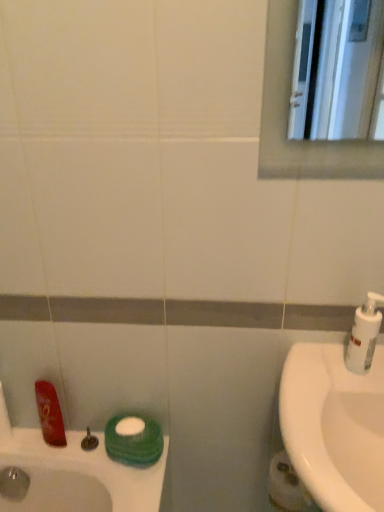
Question: Considering the relative sizes of white glossy sink at right and white matte toilet paper at lower right in the image provided, is white glossy sink at right taller than white matte toilet paper at lower right?

Choices:
 (A) yes
 (B) no

Answer: (A)

Question: Is white glossy sink at right positioned far away from white matte toilet paper at lower right?

Choices:
 (A) yes
 (B) no

Answer: (B)

Question: Is white glossy sink at right looking in the opposite direction of white matte toilet paper at lower right?

Choices:
 (A) yes
 (B) no

Answer: (B)

Question: From a real-world perspective, is white glossy sink at right positioned over white matte toilet paper at lower right based on gravity?

Choices:
 (A) yes
 (B) no

Answer: (A)

Question: Considering the relative sizes of white glossy sink at right and white matte toilet paper at lower right in the image provided, is white glossy sink at right shorter than white matte toilet paper at lower right?

Choices:
 (A) yes
 (B) no

Answer: (B)

Question: Is point (291, 500) closer or farther from the camera than point (92, 438)?

Choices:
 (A) closer
 (B) farther

Answer: (A)

Question: Considering the positions of white matte toilet paper at lower right and matte silver faucet at lower left in the image, is white matte toilet paper at lower right taller or shorter than matte silver faucet at lower left?

Choices:
 (A) tall
 (B) short

Answer: (A)

Question: Is white matte toilet paper at lower right situated inside matte silver faucet at lower left or outside?

Choices:
 (A) inside
 (B) outside

Answer: (B)

Question: Is white matte toilet paper at lower right to the left or to the right of matte silver faucet at lower left in the image?

Choices:
 (A) right
 (B) left

Answer: (A)

Question: From their relative heights in the image, would you say matte silver faucet at lower left is taller or shorter than white glossy sink at right?

Choices:
 (A) tall
 (B) short

Answer: (B)

Question: In the image, is matte silver faucet at lower left positioned in front of or behind white glossy sink at right?

Choices:
 (A) front
 (B) behind

Answer: (B)

Question: Is matte silver faucet at lower left inside or outside of white glossy sink at right?

Choices:
 (A) outside
 (B) inside

Answer: (A)

Question: Would you say matte silver faucet at lower left is to the left or to the right of white glossy sink at right in the picture?

Choices:
 (A) left
 (B) right

Answer: (A)

Question: Is white matte toilet paper at lower right in front of or behind white plastic soap dispenser at right in the image?

Choices:
 (A) behind
 (B) front

Answer: (A)

Question: Looking at their shapes, would you say white matte toilet paper at lower right is wider or thinner than white plastic soap dispenser at right?

Choices:
 (A) thin
 (B) wide

Answer: (B)